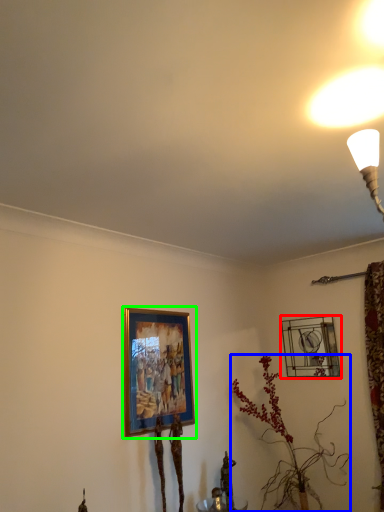
Question: Which object is the closest to the picture frame (highlighted by a red box)? Choose among these: houseplant (highlighted by a blue box) or picture frame (highlighted by a green box).

Choices:
 (A) houseplant
 (B) picture frame

Answer: (A)